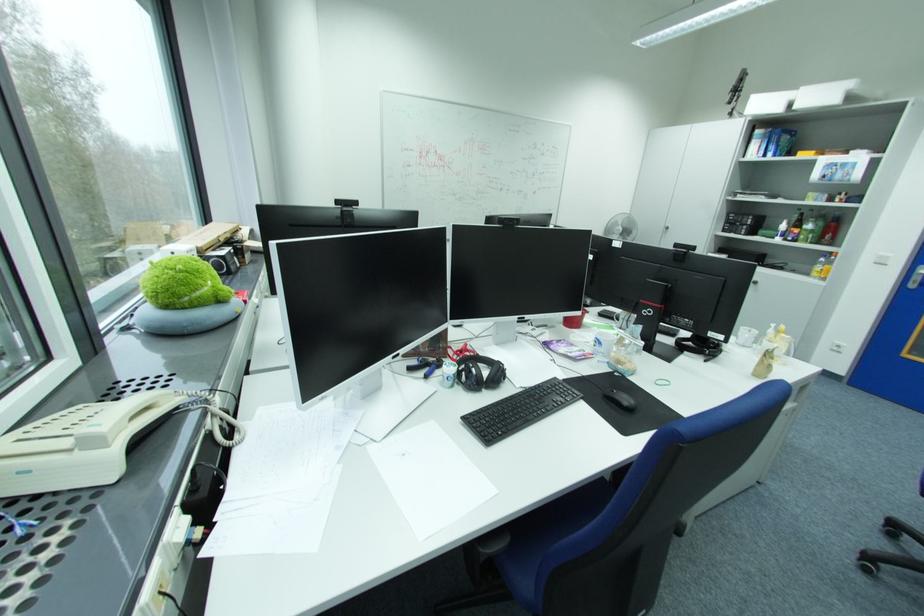
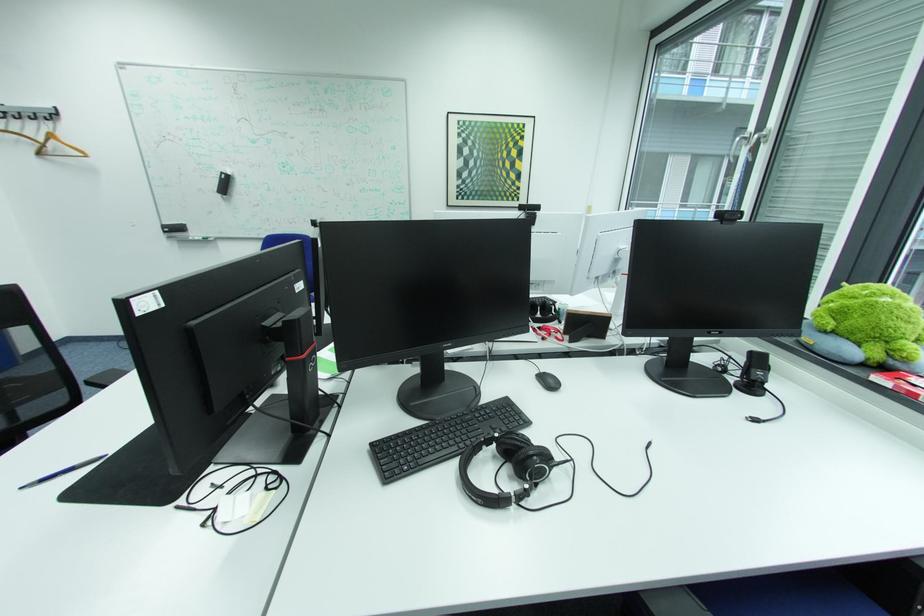
Question: I am providing you with two images of the same scene from different viewpoints. Please identify which objects are invisible in image2.

Choices:
 (A) black headphones
 (B) black cylindrical container
 (C) red scissors
 (D) white printed mug

Answer: (D)